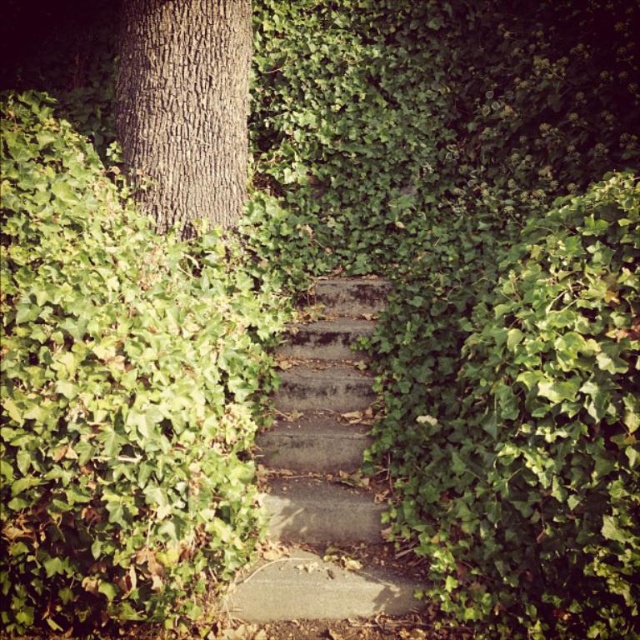
Question: Is concrete steps at center wider than smooth brown bark at upper left?

Choices:
 (A) no
 (B) yes

Answer: (B)

Question: Can you confirm if concrete steps at center is positioned to the left of smooth brown bark at upper left?

Choices:
 (A) no
 (B) yes

Answer: (A)

Question: In this image, where is concrete steps at center located relative to smooth brown bark at upper left?

Choices:
 (A) above
 (B) below

Answer: (B)

Question: Which of the following is the farthest from the observer?

Choices:
 (A) concrete steps at center
 (B) smooth brown bark at upper left

Answer: (B)

Question: Among these points, which one is farthest from the camera?

Choices:
 (A) (369, 614)
 (B) (220, 106)

Answer: (B)